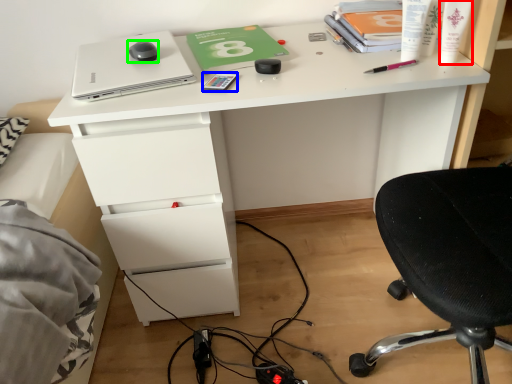
Question: Which is farther away from toiletry (highlighted by a red box)? stationery (highlighted by a blue box) or mouse (highlighted by a green box)?

Choices:
 (A) stationery
 (B) mouse

Answer: (B)